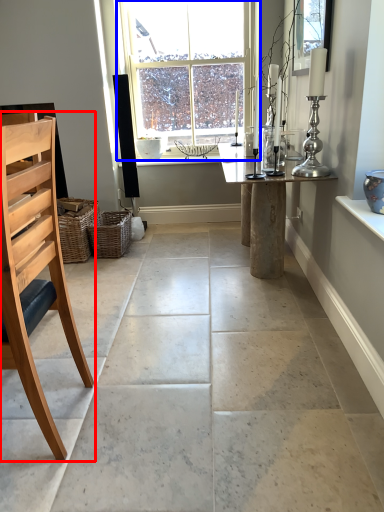
Question: Which of the following is the farthest to the observer, chair (highlighted by a red box) or window (highlighted by a blue box)?

Choices:
 (A) chair
 (B) window

Answer: (B)